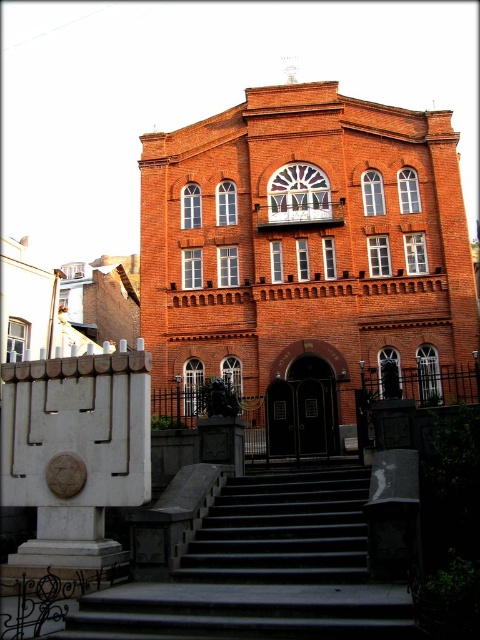
What do you see at coordinates (305, 259) in the screenshot? The height and width of the screenshot is (640, 480). I see `red brick church at center` at bounding box center [305, 259].

Between red brick church at center and black stone stairs at center, which one has less height?

black stone stairs at center

Is point (206, 156) positioned behind point (233, 508)?

Yes, it is.

The height and width of the screenshot is (640, 480). I want to click on red brick church at center, so click(x=305, y=259).